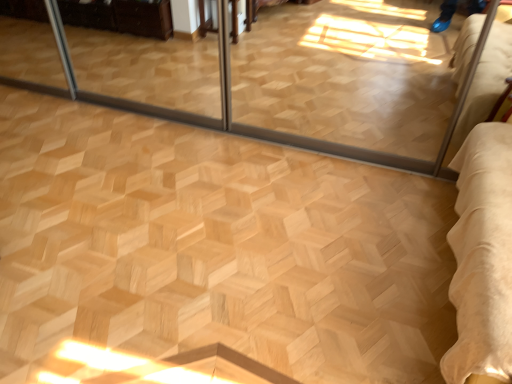
Question: Should I look upward or downward to see natural wood parquet floor at center?

Choices:
 (A) down
 (B) up

Answer: (A)